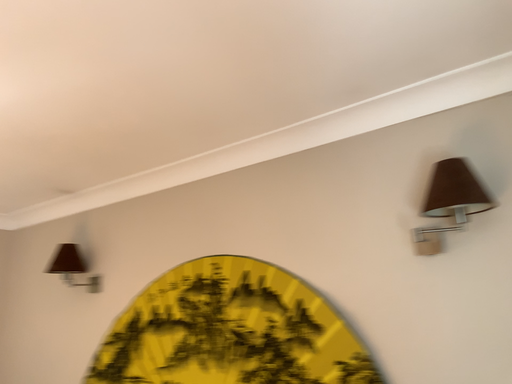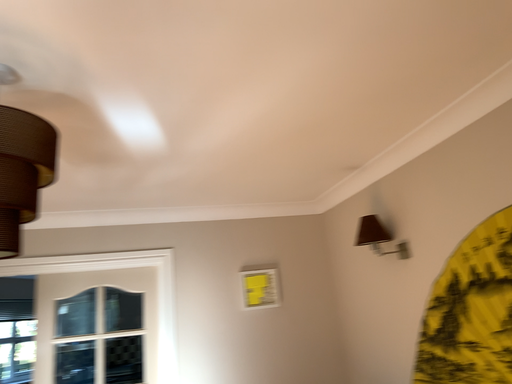
Question: How did the camera likely rotate when shooting the video?

Choices:
 (A) rotated downward
 (B) rotated upward

Answer: (A)